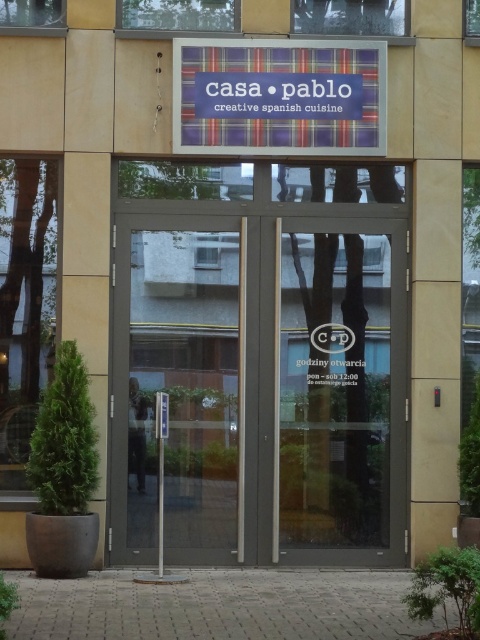
You are a delivery person approaching the entrance of Casa Pablo. You need to place a package on the silver metallic pole at center. However, there is a transparent glass door at center in the way. Can you place the package on the pole without moving the door?

The transparent glass door at center is located above the silver metallic pole at center, so you can place the package on the silver metallic pole at center since the door is above it and does not block the area where the pole is located.

You are a visitor approaching the entrance of Casa Pablo. You notice the plaid fabric sign at center and the silver metallic pole at center. Which object appears smaller in size?

The plaid fabric sign at center appears smaller in size compared to the silver metallic pole at center.

You are standing in front of the entrance of Casa Pablo. There is a plaid fabric sign at center. Where exactly is the plaid fabric sign located in relation to the entrance?

The plaid fabric sign at center is located at point 0.152 on the x axis and 0.581 on the y axis relative to the entrance.